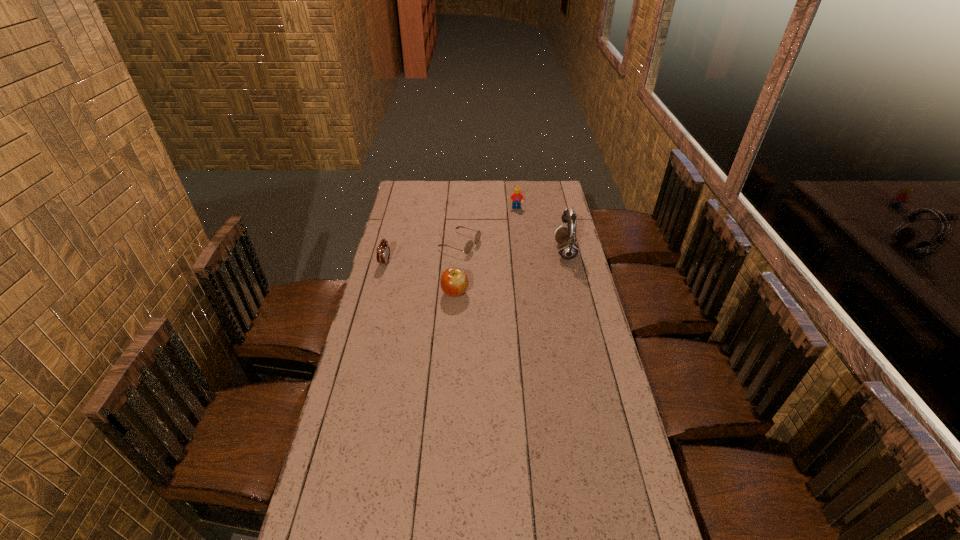
Where is `vacant space on the desktop that is between the apple and the rightmost object and is positioned on the face of the farthest object`? The image size is (960, 540). vacant space on the desktop that is between the apple and the rightmost object and is positioned on the face of the farthest object is located at coordinates (516, 271).

Image resolution: width=960 pixels, height=540 pixels. What are the coordinates of `vacant space on the desktop that is between the nearest object and the tallest object and is positioned on the lenses of the sunglasses` in the screenshot? It's located at (528, 266).

The image size is (960, 540). I want to click on free spot on the desktop that is between the apple and the tallest object and is positioned on the face of the alarm clock, so click(x=502, y=275).